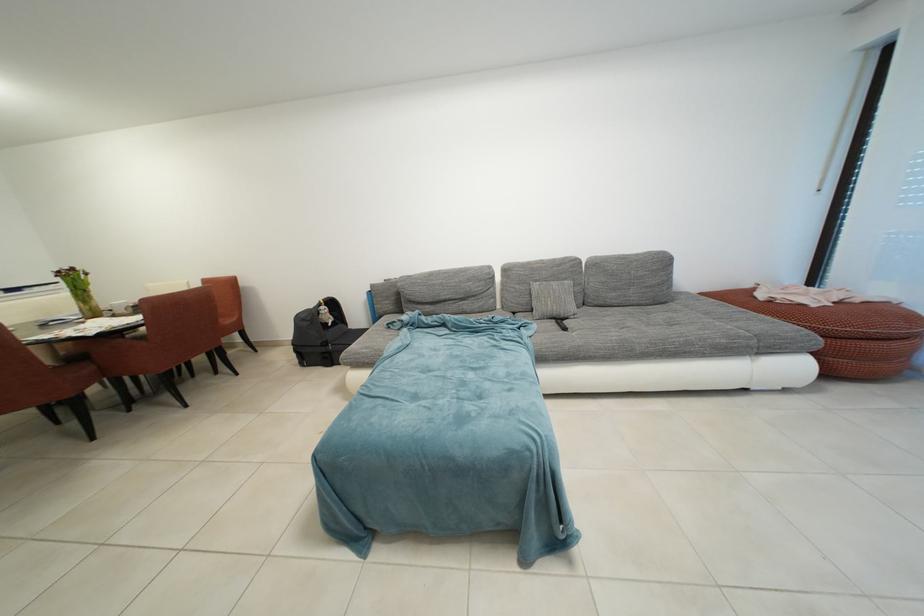
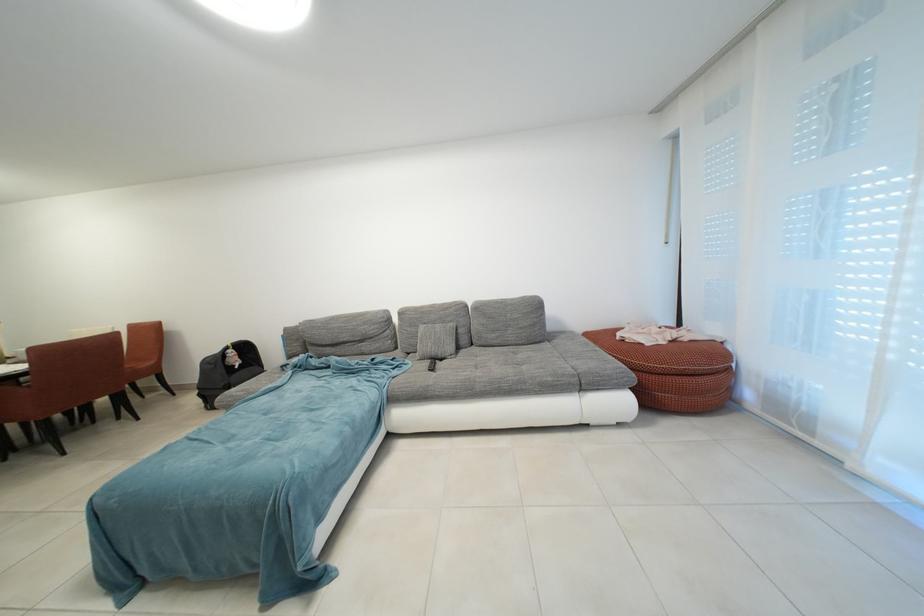
Question: Based on the continuous images, in which direction is the camera rotating? Reply with the corresponding letter.

Choices:
 (A) Left
 (B) Right
 (C) Up
 (D) Down

Answer: (C)